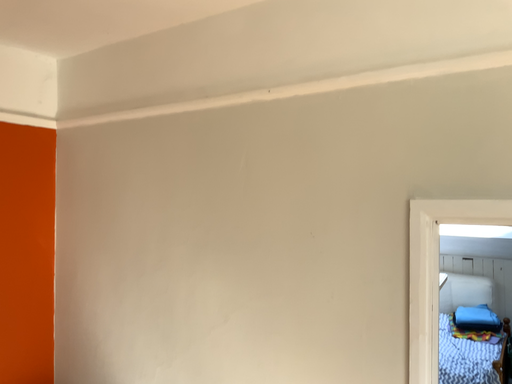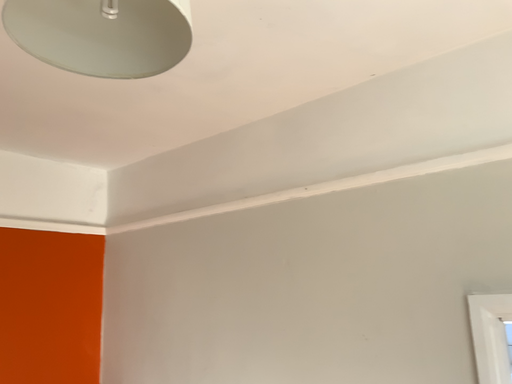
Question: Which way did the camera rotate in the video?

Choices:
 (A) rotated left
 (B) rotated right

Answer: (A)